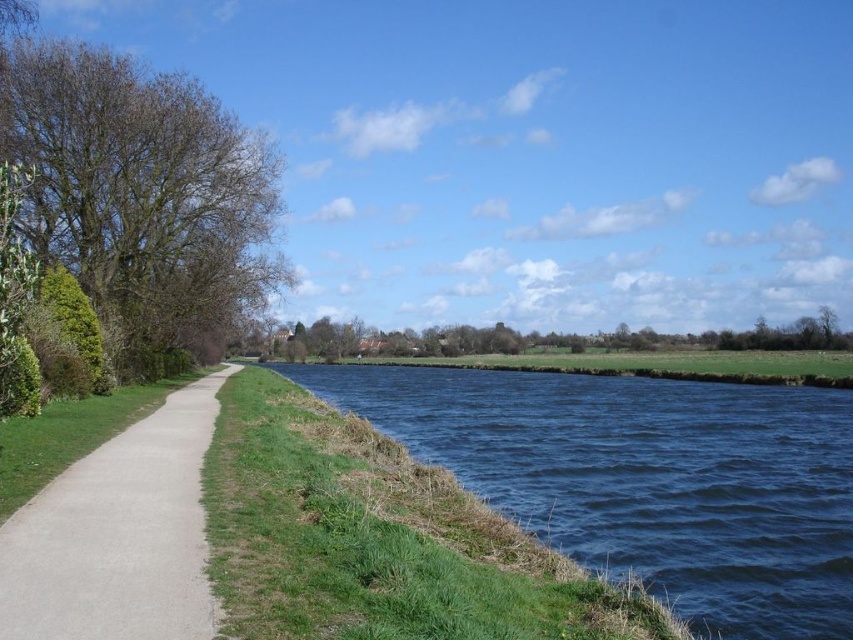
Question: Can you confirm if green leafy tree at left is thinner than gray concrete path at left?

Choices:
 (A) no
 (B) yes

Answer: (A)

Question: Among these objects, which one is farthest from the camera?

Choices:
 (A) gray concrete path at left
 (B) green leafy tree at left
 (C) blue water at center
 (D) green leafy tree at center

Answer: (D)

Question: Which point is farther from the camera taking this photo?

Choices:
 (A) (114, 461)
 (B) (701, 525)
 (C) (779, 328)

Answer: (C)

Question: Does green leafy tree at left appear under gray concrete path at left?

Choices:
 (A) no
 (B) yes

Answer: (A)

Question: Can you confirm if gray concrete path at left is positioned to the right of green leafy tree at center?

Choices:
 (A) yes
 (B) no

Answer: (B)

Question: Which object is positioned closest to the gray concrete path at left?

Choices:
 (A) green leafy tree at left
 (B) green leafy tree at center
 (C) blue water at center

Answer: (A)